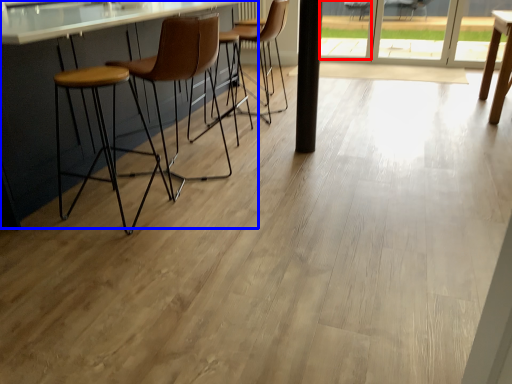
Question: Which of the following is the farthest to the observer, window (highlighted by a red box) or counter (highlighted by a blue box)?

Choices:
 (A) window
 (B) counter

Answer: (A)